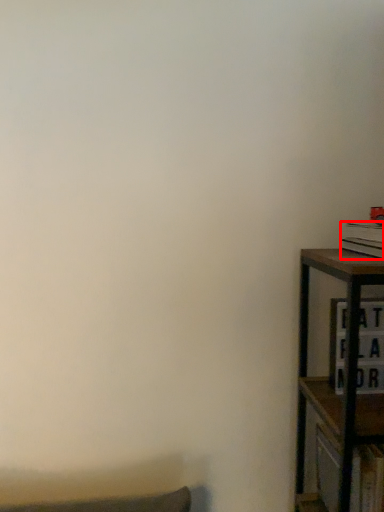
Question: From the image, what is the correct spatial relationship of book (annotated by the red box) in relation to cabinet?

Choices:
 (A) left
 (B) right

Answer: (B)